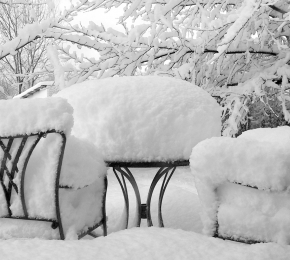
Locate an element on the screen. armrests is located at coordinates (254, 186), (75, 186).